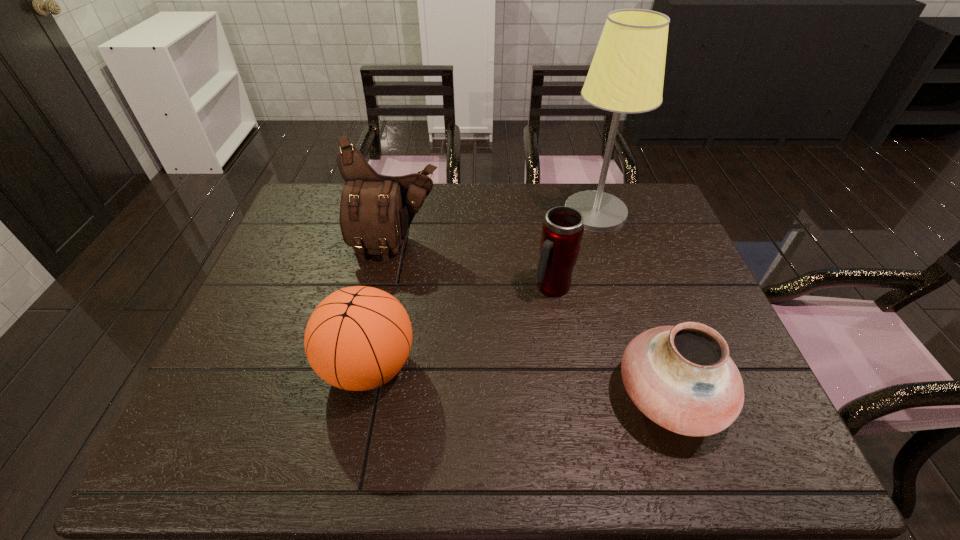
At what (x,y) coordinates should I click in order to perform the action: click on free space located on the left of the shortest object. Please return your answer as a coordinate pair (x, y). This screenshot has height=540, width=960. Looking at the image, I should click on (439, 395).

The width and height of the screenshot is (960, 540). What are the coordinates of `object at the far edge` in the screenshot? It's located at (626, 75).

Identify the location of object that is at the near edge. The image size is (960, 540). (681, 377).

Identify the location of table lamp located in the right edge section of the desktop. This screenshot has height=540, width=960. (626, 75).

Locate an element on the screen. This screenshot has width=960, height=540. pottery present at the right edge is located at coordinates point(681,377).

This screenshot has height=540, width=960. Identify the location of object located at the far right corner. (626, 75).

In order to click on object that is positioned at the near right corner in this screenshot , I will do `click(681, 377)`.

Image resolution: width=960 pixels, height=540 pixels. I want to click on free space at the near edge, so click(574, 464).

This screenshot has height=540, width=960. In the image, there is a desktop. In order to click on vacant space at the left edge in this screenshot , I will do `click(273, 254)`.

Find the location of a particular element. vacant area at the right edge is located at coordinates (676, 292).